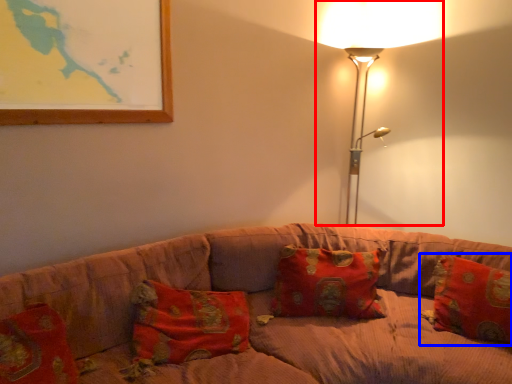
Question: Which object is closer to the camera taking this photo, lamp (highlighted by a red box) or pillow (highlighted by a blue box)?

Choices:
 (A) lamp
 (B) pillow

Answer: (B)